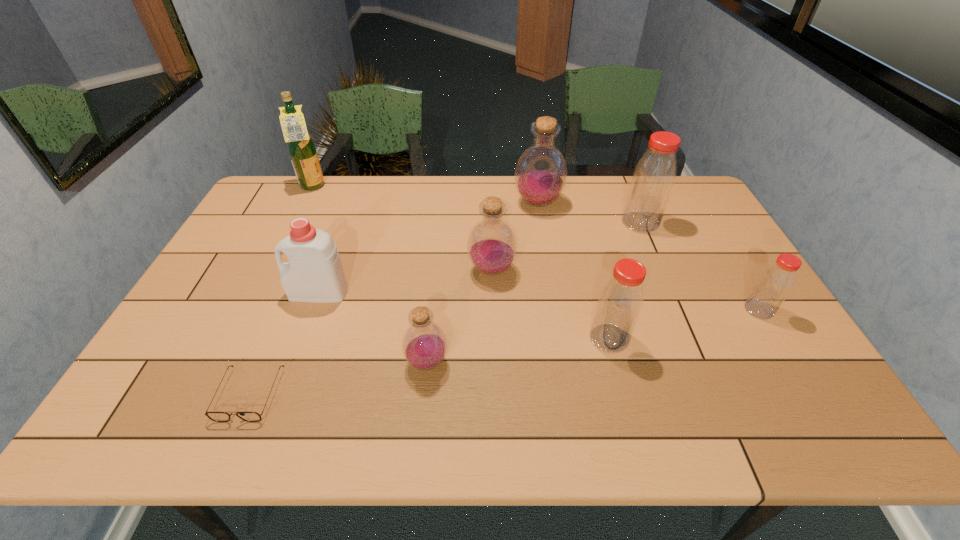
The height and width of the screenshot is (540, 960). I want to click on free space located on the handle side of the white detergent, so click(232, 292).

This screenshot has height=540, width=960. What are the coordinates of `free space located on the right of the leftmost red bottle` in the screenshot? It's located at [788, 338].

Identify the location of free region located on the front of the fifth object from left to right. The image size is (960, 540). (495, 415).

Where is `free space located on the back of the rightmost bottle`? free space located on the back of the rightmost bottle is located at coordinates (708, 226).

Identify the location of free location located on the left of the leftmost bottle. The height and width of the screenshot is (540, 960). (368, 362).

Where is `liquor present at the far edge`? The height and width of the screenshot is (540, 960). liquor present at the far edge is located at coordinates (302, 151).

Identify the location of object at the near edge. (214, 416).

The height and width of the screenshot is (540, 960). Find the location of `object that is at the left edge`. object that is at the left edge is located at coordinates (302, 151).

The height and width of the screenshot is (540, 960). Identify the location of object situated at the right edge. (774, 285).

At what (x,y) coordinates should I click in order to perform the action: click on object that is at the far left corner. Please return your answer as a coordinate pair (x, y). Looking at the image, I should click on (302, 151).